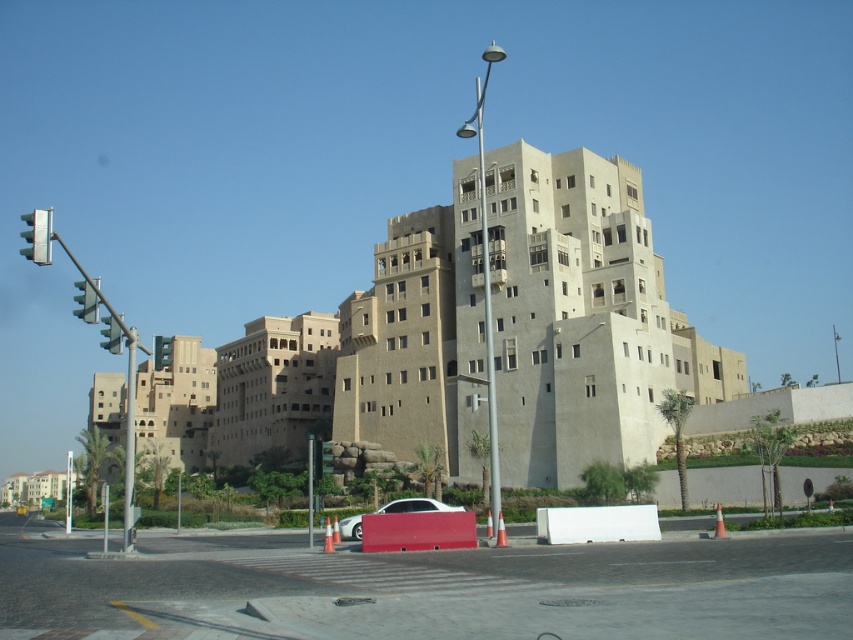
Question: Among these objects, which one is nearest to the camera?

Choices:
 (A) green glass traffic light at left
 (B) metallic traffic light at left
 (C) white glossy car at center
 (D) green glass traffic light at upper left

Answer: (B)

Question: Is white glossy car at center further to the viewer compared to metallic traffic light at left?

Choices:
 (A) yes
 (B) no

Answer: (A)

Question: From the image, what is the correct spatial relationship of white glossy car at center in relation to green metallic traffic light at left?

Choices:
 (A) right
 (B) left

Answer: (A)

Question: Can you confirm if white glossy car at center is wider than green glass traffic light at left?

Choices:
 (A) yes
 (B) no

Answer: (B)

Question: Which of the following is the closest to the observer?

Choices:
 (A) (41, 237)
 (B) (83, 284)
 (C) (445, 504)

Answer: (A)

Question: Which point appears closest to the camera in this image?

Choices:
 (A) (82, 298)
 (B) (154, 368)
 (C) (102, 346)
 (D) (398, 508)

Answer: (A)